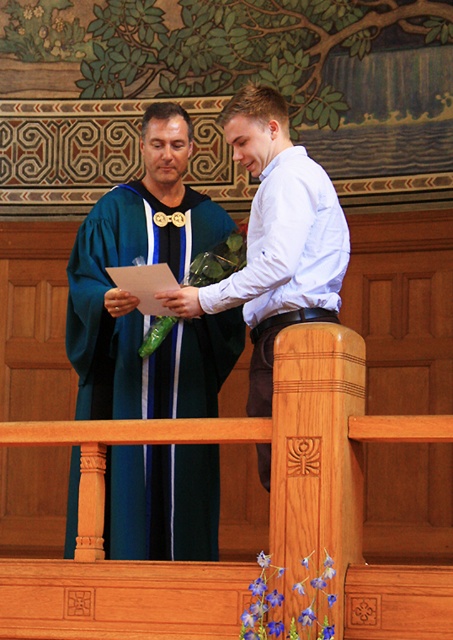
You are attending a graduation ceremony and notice two individuals at the center wearing formal attire. The teal satin gown at center and the matte green robe at center. Based on their positions, which one is closer to the front of the stage?

The teal satin gown at center is closer to the front of the stage because the matte green robe at center is positioned behind it.

You are attending a graduation ceremony and see the teal satin gown at center. Can you estimate its position in the image using coordinates?

The teal satin gown at center is located at coordinates point (x=141, y=314).

In the scene shown: You are attending a graduation ceremony and need to locate two specific points marked on the floor. The first point is at coordinates point (125, 404) and the second is at point (346, 252). Which point is closer to the stage where the academic official is standing?

Point (346, 252) is closer to the stage where the academic official is standing because it is in front of point (125, 404), which is behind it.